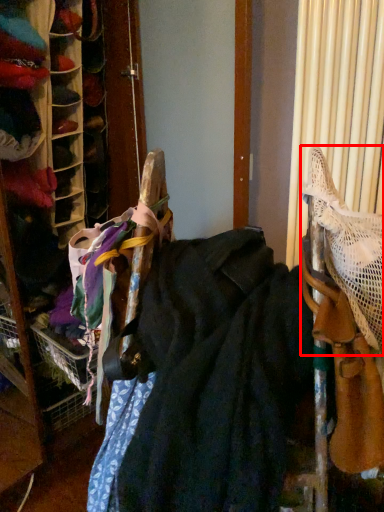
Question: From the image, what is the correct spatial relationship of wide (annotated by the red box) in relation to wide?

Choices:
 (A) left
 (B) right

Answer: (B)